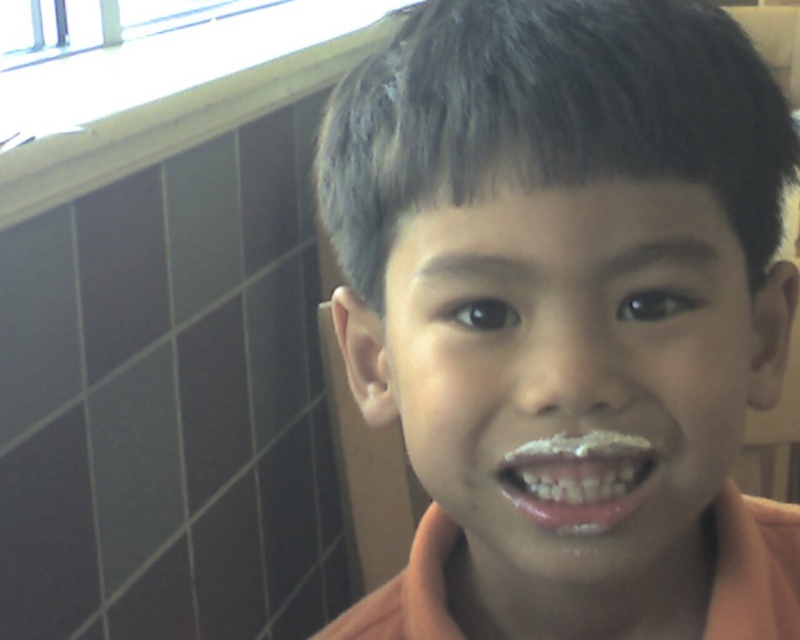
You are a photographer standing 1 meter away from the orange matte shirt at center. You want to take a closeup shot of it. Is the current distance sufficient for a clear closeup? Explain based on the shirt distance from the viewer.

The orange matte shirt at center is 26.67 centimeters away from the viewer. Since you are standing 1 meter away, which is 100 centimeters, the distance is more than sufficient for a clear closeup. However, if you want an even closer shot, moving to about 30 centimeters would be ideal.